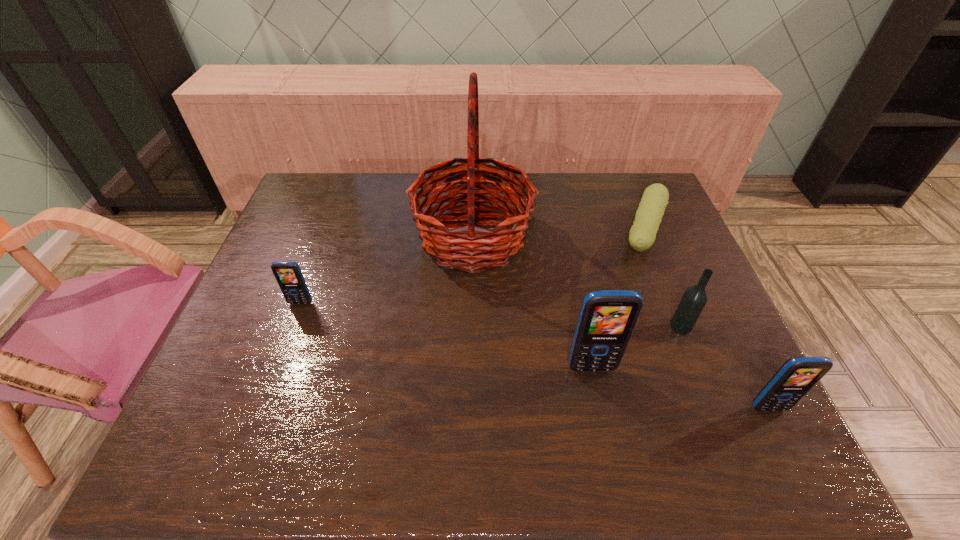
Select which cellular telephone is the second closest to the shortest cellular telephone. Please provide its 2D coordinates. Your answer should be formatted as a tuple, i.e. [(x, y)], where the tuple contains the x and y coordinates of a point satisfying the conditions above.

[(797, 375)]

Identify the location of vacant area that satisfies the following two spatial constraints: 1. on the handle side of the basket; 2. on the screen of the fourth nearest object. The height and width of the screenshot is (540, 960). (472, 303).

Identify the location of vacant space that satisfies the following two spatial constraints: 1. on the screen of the vodka; 2. on the right side of the second shortest object. This screenshot has width=960, height=540. (293, 326).

Where is `vacant space that satisfies the following two spatial constraints: 1. on the front side of the cucumber; 2. on the handle side of the basket`? vacant space that satisfies the following two spatial constraints: 1. on the front side of the cucumber; 2. on the handle side of the basket is located at coordinates (646, 238).